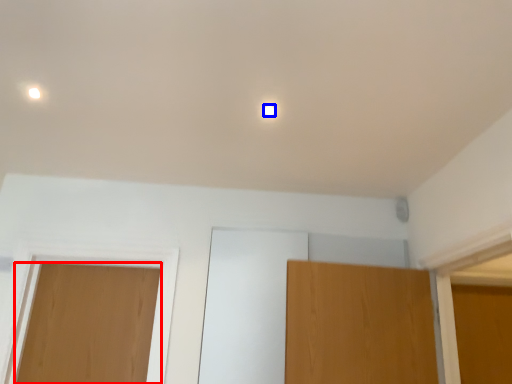
Question: Which object appears farthest to the camera in this image, door (highlighted by a red box) or dot (highlighted by a blue box)?

Choices:
 (A) door
 (B) dot

Answer: (A)